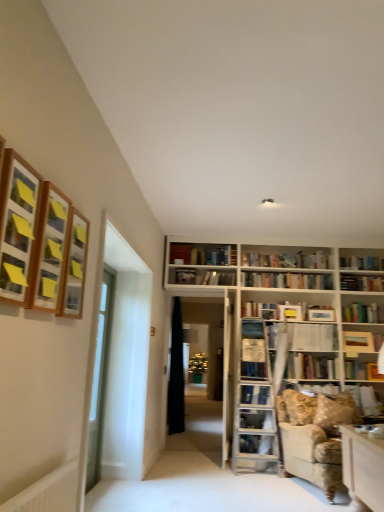
Question: Which direction should I rotate to look at hardcover book at center, which is the 4th book in back-to-front order?

Choices:
 (A) right
 (B) left

Answer: (A)

Question: From a real-world perspective, is wooden frame at upper left, the first shelf viewed from the back, on top of hardcover book at center, positioned as the second book in bottom-to-top order?

Choices:
 (A) no
 (B) yes

Answer: (B)

Question: Considering the relative sizes of wooden frame at upper left, arranged as the 3th shelf when viewed from the front, and hardcover book at center, positioned as the second book in bottom-to-top order, in the image provided, is wooden frame at upper left, arranged as the 3th shelf when viewed from the front, thinner than hardcover book at center, positioned as the second book in bottom-to-top order,?

Choices:
 (A) no
 (B) yes

Answer: (B)

Question: Is wooden frame at upper left, arranged as the 3th shelf when viewed from the front, smaller than hardcover book at center, which is the 4th book in back-to-front order?

Choices:
 (A) yes
 (B) no

Answer: (B)

Question: Considering the relative sizes of wooden frame at upper left, arranged as the 3th shelf when viewed from the front, and hardcover book at center, positioned as the second book in bottom-to-top order, in the image provided, is wooden frame at upper left, arranged as the 3th shelf when viewed from the front, shorter than hardcover book at center, positioned as the second book in bottom-to-top order,?

Choices:
 (A) yes
 (B) no

Answer: (B)

Question: Is wooden frame at upper left, the first shelf viewed from the back, oriented towards hardcover book at center, which is the 4th book in back-to-front order?

Choices:
 (A) no
 (B) yes

Answer: (A)

Question: Can you see wooden frame at upper left, the first shelf viewed from the back, touching hardcover book at center, positioned as the second book in bottom-to-top order?

Choices:
 (A) no
 (B) yes

Answer: (A)

Question: Does wooden framed picture at upper left, acting as the 3th shelf starting from the back, lie behind wooden bookshelf at upper center, marked as the 3th book in a bottom-to-top arrangement?

Choices:
 (A) no
 (B) yes

Answer: (A)

Question: From a real-world perspective, is wooden framed picture at upper left, acting as the 3th shelf starting from the back, on top of wooden bookshelf at upper center, the first book positioned from the back?

Choices:
 (A) yes
 (B) no

Answer: (A)

Question: Is wooden framed picture at upper left, the first shelf viewed from the front, bigger than wooden bookshelf at upper center, the first book positioned from the back?

Choices:
 (A) no
 (B) yes

Answer: (B)

Question: Can you confirm if wooden framed picture at upper left, acting as the 3th shelf starting from the back, is positioned to the left of wooden bookshelf at upper center, the first book positioned from the back?

Choices:
 (A) yes
 (B) no

Answer: (A)

Question: From a real-world perspective, does wooden framed picture at upper left, the first shelf viewed from the front, sit lower than wooden bookshelf at upper center, marked as the 3th book in a bottom-to-top arrangement?

Choices:
 (A) yes
 (B) no

Answer: (B)

Question: Does wooden framed picture at upper left, acting as the 3th shelf starting from the back, have a greater width compared to wooden bookshelf at upper center, the first book positioned from the back?

Choices:
 (A) yes
 (B) no

Answer: (A)

Question: Is hardcover book at center, which ranks as the 1th book in front-to-back order, further to the viewer compared to wooden frame at upper left, which is the 2th shelf from back to front?

Choices:
 (A) yes
 (B) no

Answer: (A)